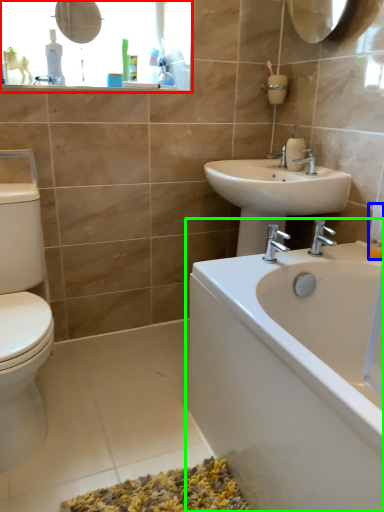
Question: Estimate the real-world distances between objects in this image. Which object is farther from medicine cabinet (highlighted by a red box), toiletry (highlighted by a blue box) or bathtub (highlighted by a green box)?

Choices:
 (A) toiletry
 (B) bathtub

Answer: (A)